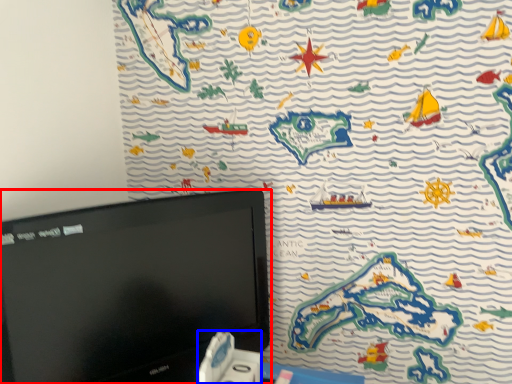
Question: Which point is further to the camera, computer monitor (highlighted by a red box) or game controller (highlighted by a blue box)?

Choices:
 (A) computer monitor
 (B) game controller

Answer: (B)